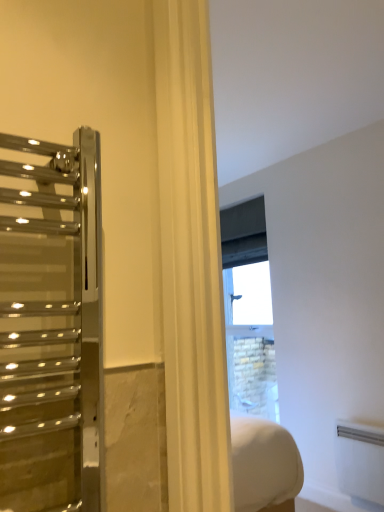
This screenshot has width=384, height=512. In order to click on clear glass window at upper center in this screenshot , I will do `click(249, 310)`.

What is the approximate height of clear glass window at upper center?

The height of clear glass window at upper center is 4.63 feet.

This screenshot has height=512, width=384. Describe the element at coordinates (249, 310) in the screenshot. I see `clear glass window at upper center` at that location.

Find the location of a particular element. The height and width of the screenshot is (512, 384). clear glass window at upper center is located at coordinates (249, 310).